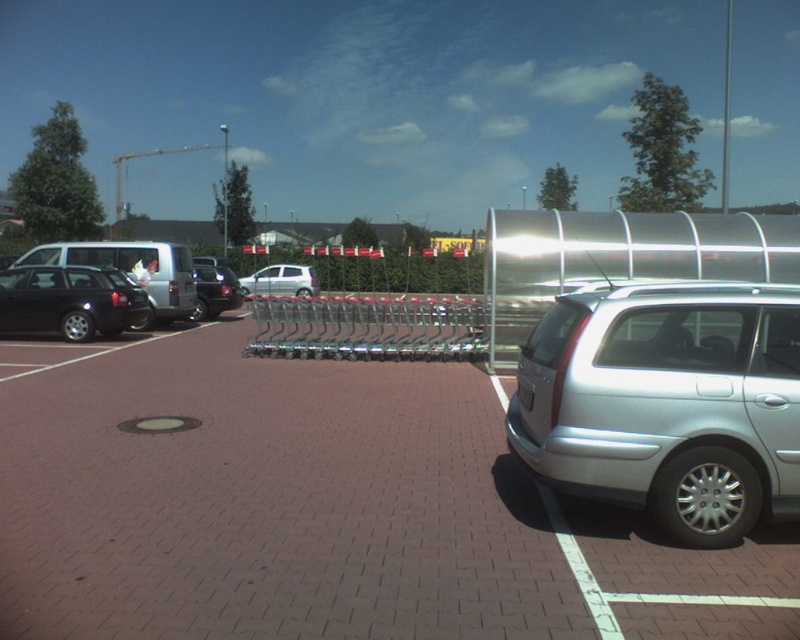
You are a delivery driver who needs to park your vehicle in the parking lot shown. You see a shiny black sedan at center and a black plastic license plate at lower right. Which object is closer to the left side of the parking lot?

The shiny black sedan at center is positioned on the left side of the black plastic license plate at lower right, so it is closer to the left side of the parking lot.

You are standing in the parking lot and want to locate two specific points marked in the image. Which of the two points, point (46, 284) or point (80, 241), is closer to your current position?

Point (46, 284) is closer to the viewer than point (80, 241).

You are standing at the entrance of the parking lot and want to park your car in the closest available spot to the shiny black sedan at center. Based on the scene, where should you park?

The closest available parking spot to the shiny black sedan at center would be the one directly in front of it since the sedan is positioned at point (214, 289), which is centrally located in the parking lot.